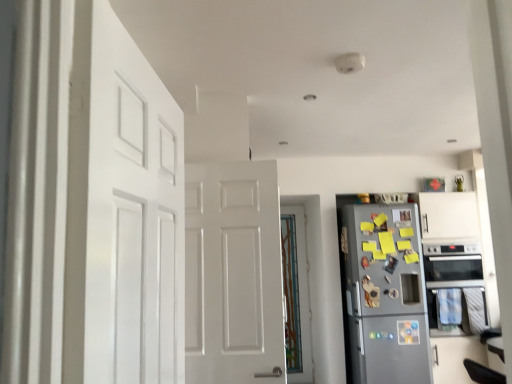
Question: Considering the relative sizes of translucent glass door at center, the 1th door viewed from the back, and black glass oven at right in the image provided, is translucent glass door at center, the 1th door viewed from the back, thinner than black glass oven at right?

Choices:
 (A) yes
 (B) no

Answer: (A)

Question: Is translucent glass door at center, the 1th door from the right, far from black glass oven at right?

Choices:
 (A) yes
 (B) no

Answer: (A)

Question: Is translucent glass door at center, the second door viewed from the left, in front of black glass oven at right?

Choices:
 (A) yes
 (B) no

Answer: (B)

Question: From the image's perspective, would you say translucent glass door at center, the 1th door from the right, is shown under black glass oven at right?

Choices:
 (A) yes
 (B) no

Answer: (A)

Question: From a real-world perspective, is translucent glass door at center, marked as the second door in a front-to-back arrangement, located higher than black glass oven at right?

Choices:
 (A) no
 (B) yes

Answer: (A)

Question: Does translucent glass door at center, the second door viewed from the left, contain black glass oven at right?

Choices:
 (A) no
 (B) yes

Answer: (A)

Question: Considering the relative positions of metallic gray refrigerator at right and translucent glass door at center, marked as the second door in a front-to-back arrangement, in the image provided, is metallic gray refrigerator at right to the left of translucent glass door at center, marked as the second door in a front-to-back arrangement, from the viewer's perspective?

Choices:
 (A) no
 (B) yes

Answer: (A)

Question: Considering the relative sizes of metallic gray refrigerator at right and translucent glass door at center, the second door viewed from the left, in the image provided, is metallic gray refrigerator at right thinner than translucent glass door at center, the second door viewed from the left,?

Choices:
 (A) yes
 (B) no

Answer: (B)

Question: Considering the relative positions of metallic gray refrigerator at right and translucent glass door at center, the 1th door viewed from the back, in the image provided, is metallic gray refrigerator at right in front of translucent glass door at center, the 1th door viewed from the back,?

Choices:
 (A) no
 (B) yes

Answer: (B)

Question: Are metallic gray refrigerator at right and translucent glass door at center, the 1th door viewed from the back, beside each other?

Choices:
 (A) no
 (B) yes

Answer: (A)

Question: Is translucent glass door at center, the second door viewed from the left, located within metallic gray refrigerator at right?

Choices:
 (A) yes
 (B) no

Answer: (B)

Question: Considering the relative sizes of metallic gray refrigerator at right and translucent glass door at center, the 1th door viewed from the back, in the image provided, is metallic gray refrigerator at right taller than translucent glass door at center, the 1th door viewed from the back,?

Choices:
 (A) no
 (B) yes

Answer: (A)

Question: Is black glass oven at right wider than metallic gray refrigerator at right?

Choices:
 (A) no
 (B) yes

Answer: (B)